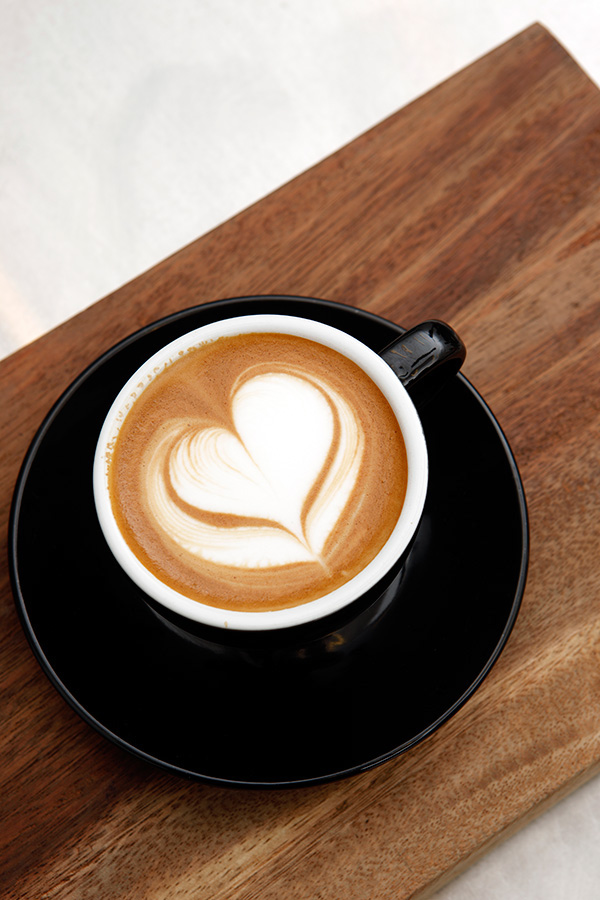
The width and height of the screenshot is (600, 900). In order to click on coffee foam art in this screenshot , I will do `click(284, 454)`.